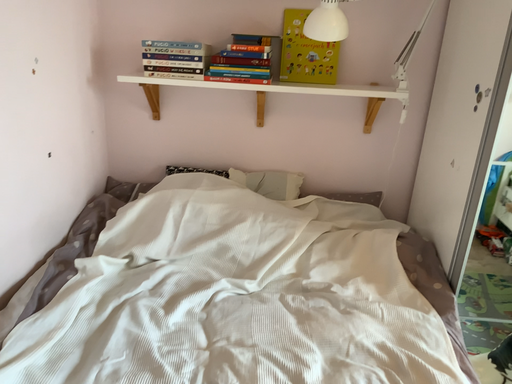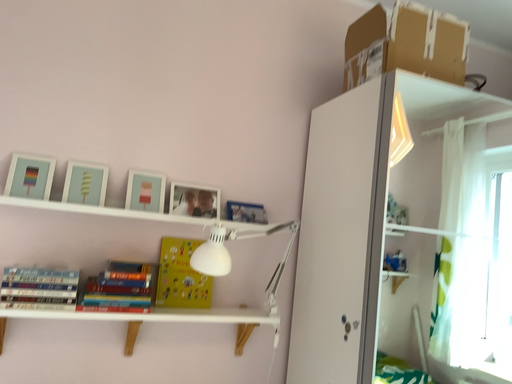
Question: Which way did the camera rotate in the video?

Choices:
 (A) rotated left
 (B) rotated right

Answer: (B)